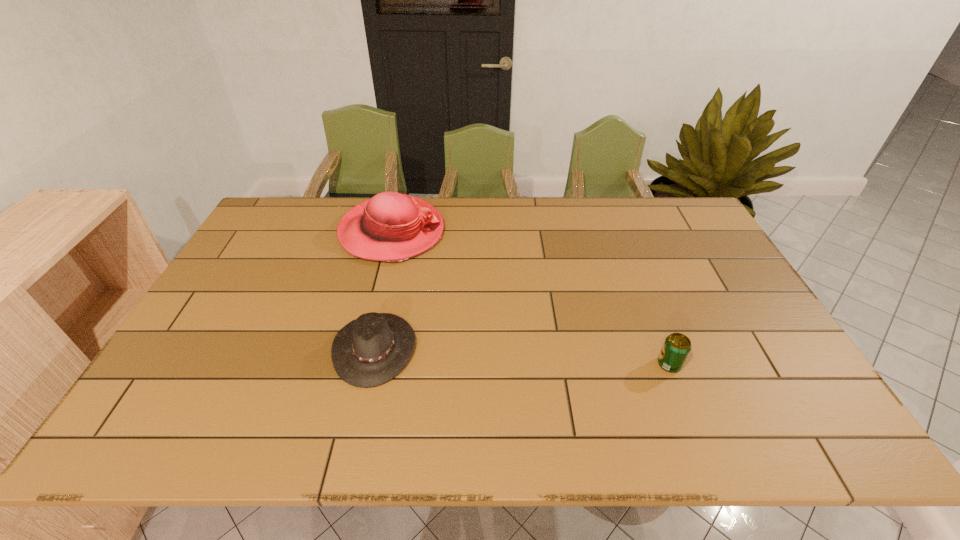
Find the location of a particular element. This screenshot has height=540, width=960. the tallest object is located at coordinates (391, 227).

Image resolution: width=960 pixels, height=540 pixels. I want to click on the farther hat, so click(x=391, y=227).

Image resolution: width=960 pixels, height=540 pixels. In order to click on beer can in this screenshot , I will do `click(676, 348)`.

I want to click on the nearer hat, so click(371, 350).

Image resolution: width=960 pixels, height=540 pixels. In order to click on vacant region located 0.380m at the front of the taller hat with a bow in this screenshot , I will do `click(557, 232)`.

Locate an element on the screen. The image size is (960, 540). free point located 0.080m on the front of the rightmost object is located at coordinates (684, 403).

Locate an element on the screen. free location located on the front-facing side of the shorter hat is located at coordinates (482, 348).

I want to click on object that is at the far edge, so click(x=391, y=227).

Locate an element on the screen. The height and width of the screenshot is (540, 960). free location at the far edge of the desktop is located at coordinates (521, 207).

In the image, there is a desktop. In order to click on blank space at the left edge in this screenshot , I will do `click(233, 272)`.